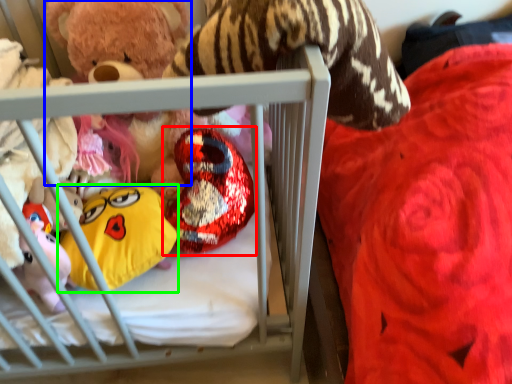
Question: Which object is the farthest from toy (highlighted by a red box)? Choose among these: toy (highlighted by a blue box) or toy (highlighted by a green box).

Choices:
 (A) toy
 (B) toy

Answer: (A)